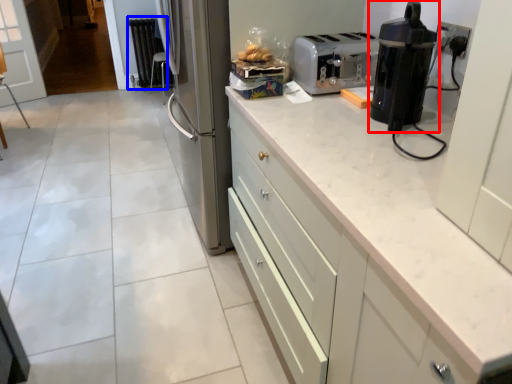
Question: Which object appears closest to the camera in this image, home appliance (highlighted by a red box) or radiator (highlighted by a blue box)?

Choices:
 (A) home appliance
 (B) radiator

Answer: (A)